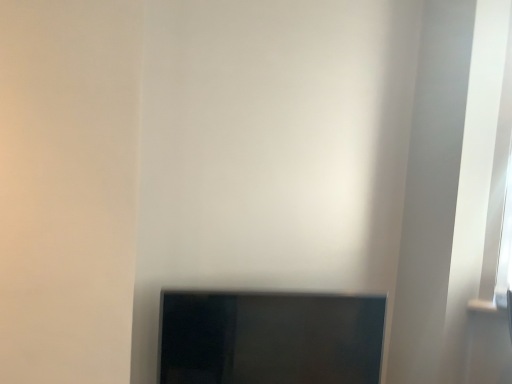
Describe the element at coordinates (271, 338) in the screenshot. This screenshot has width=512, height=384. I see `black glossy tv at lower center` at that location.

You are a GUI agent. You are given a task and a screenshot of the screen. Output one action in this format:
    pyautogui.click(x=<x>, y=<y>)
    Task: Click on the black glossy tv at lower center
    
    Given the screenshot: What is the action you would take?
    pyautogui.click(x=271, y=338)

Where is `black glossy tv at lower center`? The height and width of the screenshot is (384, 512). black glossy tv at lower center is located at coordinates (271, 338).